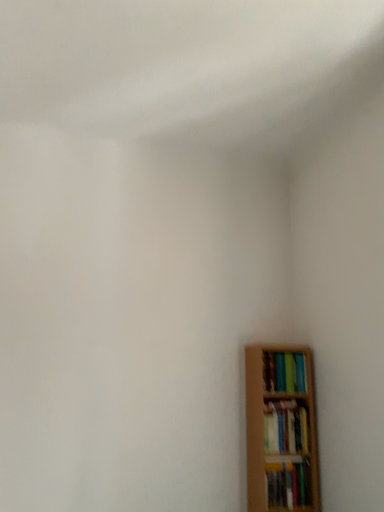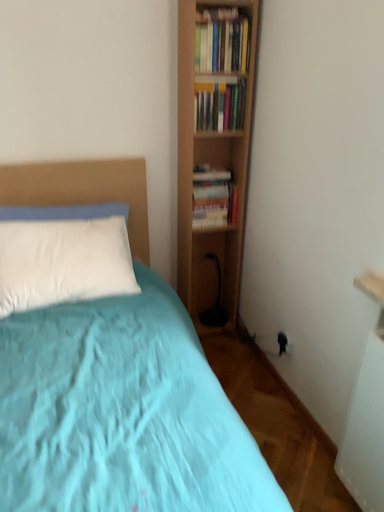
Question: How did the camera likely rotate when shooting the video?

Choices:
 (A) rotated downward
 (B) rotated upward

Answer: (A)